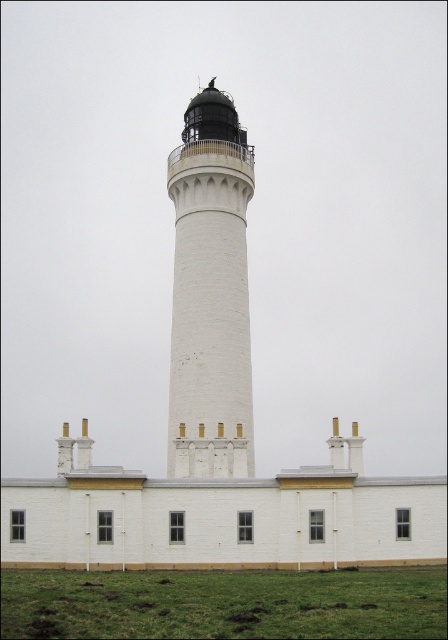
Question: Which of the following is the farthest from the observer?

Choices:
 (A) (219, 90)
 (B) (440, 595)

Answer: (A)

Question: Does green grass at lower center appear under white matte/lightweight tower at center?

Choices:
 (A) no
 (B) yes

Answer: (B)

Question: Can you confirm if green grass at lower center is thinner than white matte/lightweight tower at center?

Choices:
 (A) yes
 (B) no

Answer: (B)

Question: Does green grass at lower center lie in front of white matte/lightweight tower at center?

Choices:
 (A) no
 (B) yes

Answer: (B)